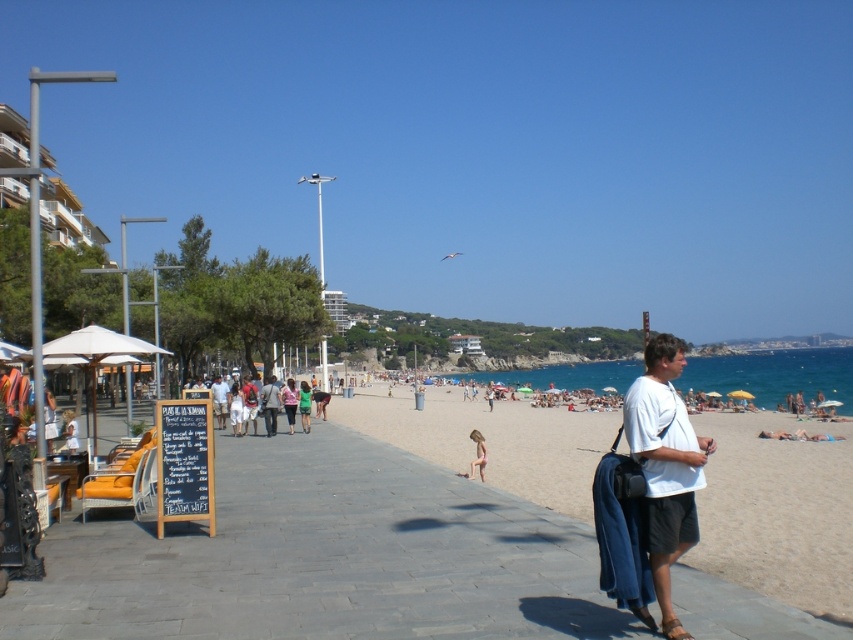
You are standing on the paved promenade and see the beige sand at beach center and the pink fabric bikini at lower center. Which object is closer to your right side?

The beige sand at beach center is to the right of the pink fabric bikini at lower center, so the beige sand at beach center is closer to your right side.